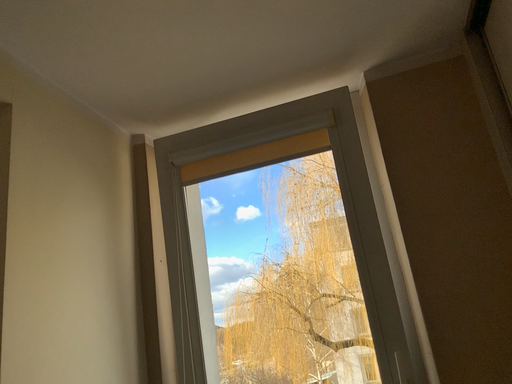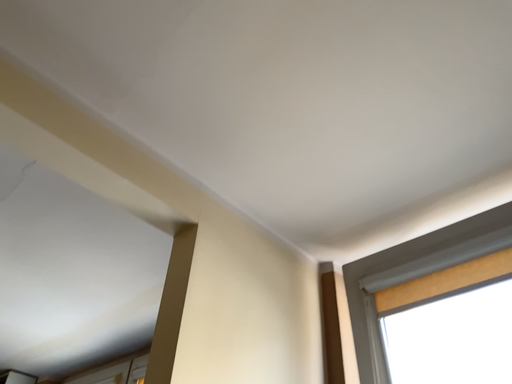
Question: Which way did the camera rotate in the video?

Choices:
 (A) rotated left
 (B) rotated right

Answer: (A)